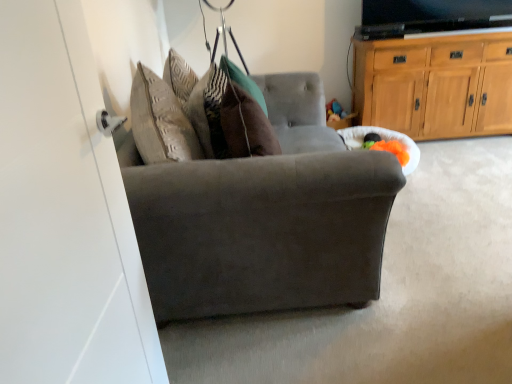
Question: From a real-world perspective, is light brown wood cabinet at upper right above or below brown velvet pillow at center?

Choices:
 (A) above
 (B) below

Answer: (B)

Question: Is light brown wood cabinet at upper right to the left or to the right of brown velvet pillow at center in the image?

Choices:
 (A) left
 (B) right

Answer: (B)

Question: Estimate the real-world distances between objects in this image. Which object is farther from the light brown wood cabinet at upper right?

Choices:
 (A) suede gray chair at center
 (B) brown velvet pillow at center

Answer: (B)

Question: Which object is the farthest from the light brown wood cabinet at upper right?

Choices:
 (A) suede gray chair at center
 (B) brown velvet pillow at center

Answer: (B)